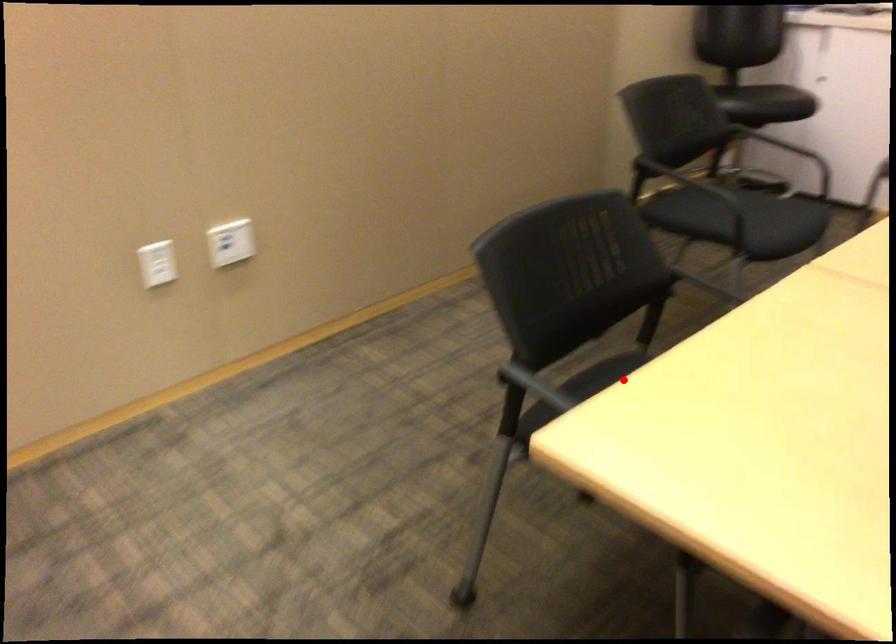
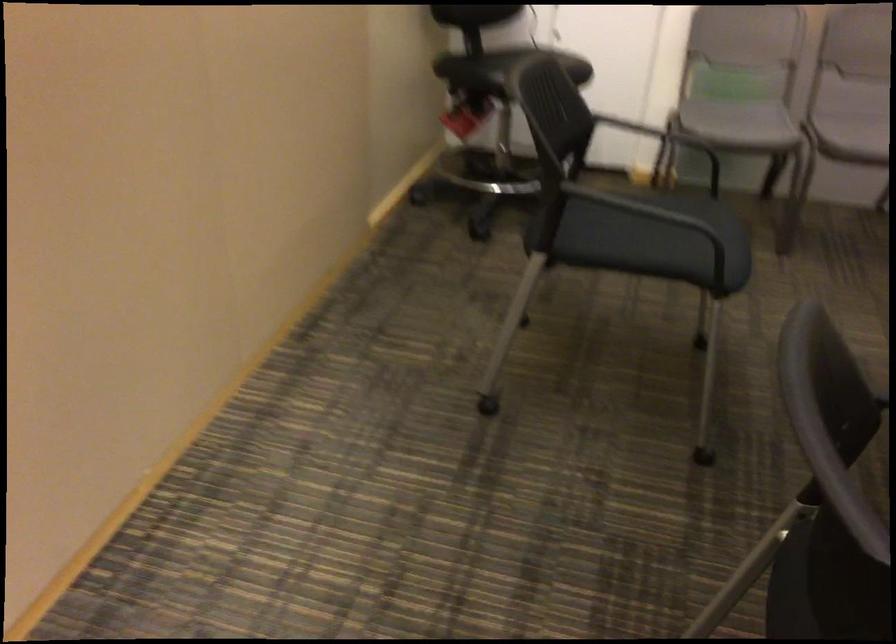
Question: I am providing you with two images of the same scene from different viewpoints. Given a red point in image1, look at the same physical point in image2. Is it:

Choices:
 (A) Closer to the viewpoint
 (B) Farther from the viewpoint

Answer: (A)